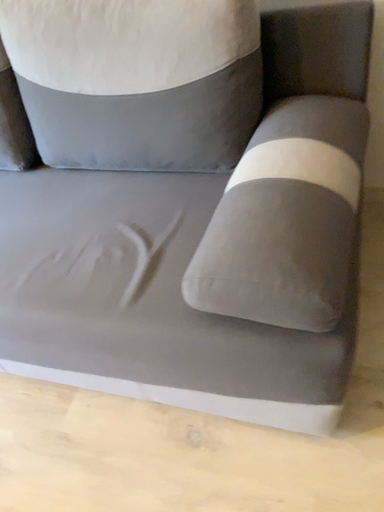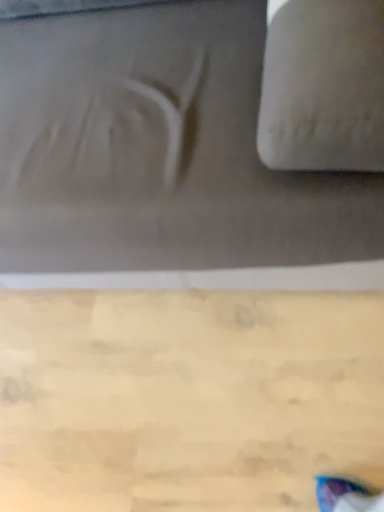
Question: Which way did the camera rotate in the video?

Choices:
 (A) rotated right
 (B) rotated left

Answer: (A)